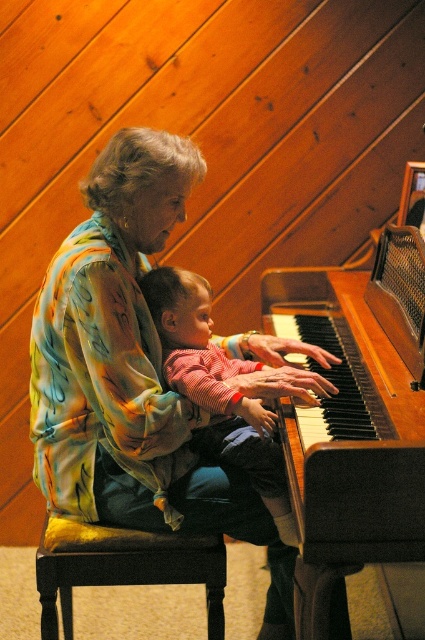
Question: Can you confirm if multicolored silk blouse at upper left is bigger than striped cotton shirt at center?

Choices:
 (A) no
 (B) yes

Answer: (B)

Question: Estimate the real-world distances between objects in this image. Which object is farther from the velvet cushioned stool at lower left?

Choices:
 (A) multicolored silk blouse at upper left
 (B) wooden piano at center
 (C) striped cotton shirt at center

Answer: (B)

Question: Is multicolored silk blouse at upper left wider than striped cotton shirt at center?

Choices:
 (A) yes
 (B) no

Answer: (A)

Question: Which of the following is the closest to the observer?

Choices:
 (A) velvet cushioned stool at lower left
 (B) wooden piano at center

Answer: (B)

Question: Estimate the real-world distances between objects in this image. Which object is closer to the wooden piano at center?

Choices:
 (A) striped cotton shirt at center
 (B) velvet cushioned stool at lower left

Answer: (A)

Question: Can you confirm if striped cotton shirt at center is positioned below velvet cushioned stool at lower left?

Choices:
 (A) no
 (B) yes

Answer: (A)